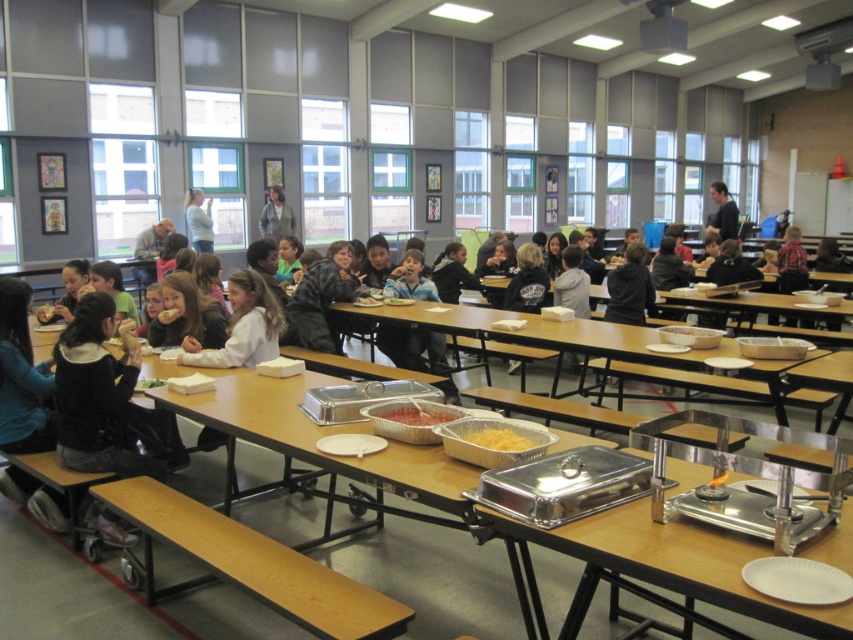
Can you confirm if yellow shredded cheese at center is positioned below yellow matte banana at center?

Yes.

Which is more to the left, yellow shredded cheese at center or yellow matte banana at center?

From the viewer's perspective, yellow matte banana at center appears more on the left side.

Who is more forward, (496, 435) or (158, 312)?

Point (496, 435)

Where is `yellow shredded cheese at center`? This screenshot has width=853, height=640. yellow shredded cheese at center is located at coordinates (498, 440).

Is point (677, 564) less distant than point (270, 205)?

Yes, it is in front of point (270, 205).

Looking at this image, who is higher up, silver metallic buffet at center or light blue denim jacket at upper center?

light blue denim jacket at upper center is above.

Is point (824, 609) farther from viewer compared to point (271, 208)?

No, (824, 609) is in front of (271, 208).

What are the coordinates of `silver metallic buffet at center` in the screenshot? It's located at (677, 563).

Does silver metallic trays at center appear under yellow shredded cheese at center?

Incorrect, silver metallic trays at center is not positioned below yellow shredded cheese at center.

From the picture: Who is more distant from viewer, (x=634, y=356) or (x=523, y=436)?

The point (x=634, y=356) is behind.

This screenshot has width=853, height=640. Identify the location of silver metallic trays at center. (540, 332).